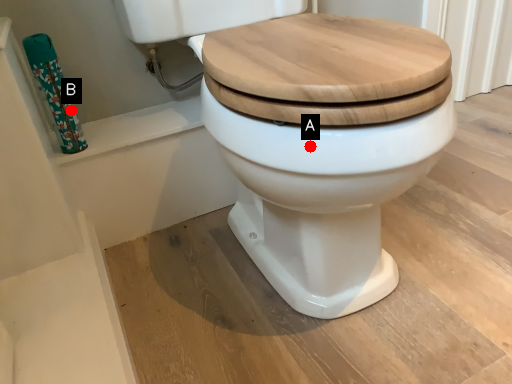
Question: Two points are circled on the image, labeled by A and B beside each circle. Which point is closer to the camera?

Choices:
 (A) A is closer
 (B) B is closer

Answer: (A)